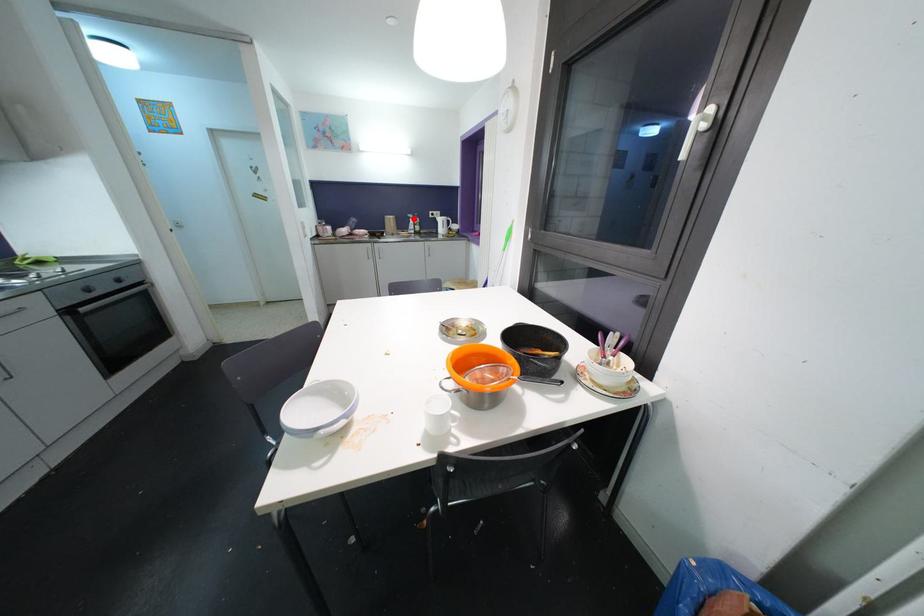
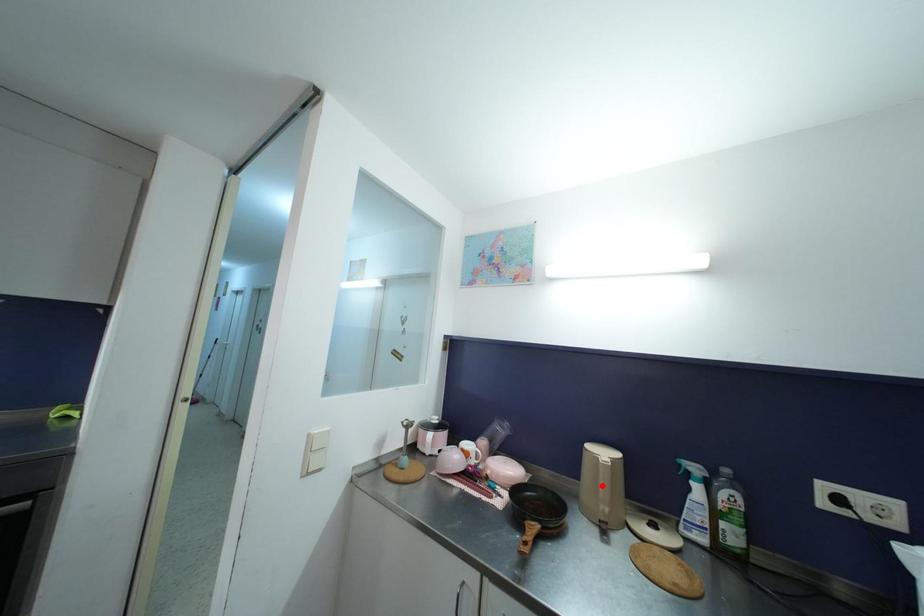
I am providing you with two images of the same scene from different viewpoints. A red point is marked on the first image and another point is marked on the second image. Does the point marked in image1 correspond to the same location as the one in image2?

No